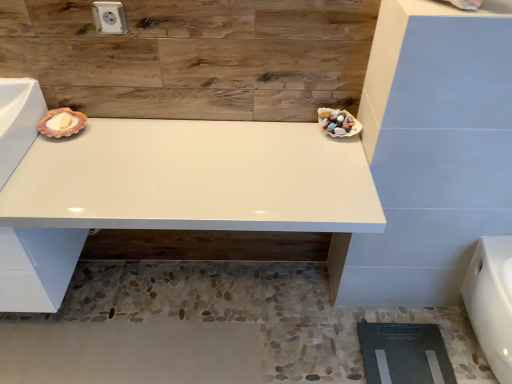
This screenshot has height=384, width=512. What are the coordinates of `white glossy porcelain at lower right` in the screenshot? It's located at (492, 302).

Locate an element on the screen. This screenshot has height=384, width=512. white plastic electric outlet at upper center is located at coordinates (109, 17).

Does white glossy vanity at center lie in front of white plastic electric outlet at upper center?

That is True.

From a real-world perspective, which object stands above the other?

white plastic electric outlet at upper center.

Do you think white glossy vanity at center is within white plastic electric outlet at upper center, or outside of it?

white glossy vanity at center is outside white plastic electric outlet at upper center.

Considering the sizes of objects white glossy vanity at center and white plastic electric outlet at upper center in the image provided, who is thinner, white glossy vanity at center or white plastic electric outlet at upper center?

white plastic electric outlet at upper center is thinner.

Are white plastic electric outlet at upper center and white glossy porcelain at lower right making contact?

white plastic electric outlet at upper center and white glossy porcelain at lower right are not in contact.

Does white plastic electric outlet at upper center contain white glossy porcelain at lower right?

No, white glossy porcelain at lower right is not inside white plastic electric outlet at upper center.

Is white glossy porcelain at lower right at the back of white plastic electric outlet at upper center?

white plastic electric outlet at upper center is not turned away from white glossy porcelain at lower right.

Considering the positions of points (98, 6) and (497, 322), is point (98, 6) farther from camera compared to point (497, 322)?

No, it is in front of (497, 322).

Considering the points (467, 275) and (124, 18), which point is in front, point (467, 275) or point (124, 18)?

Point (124, 18)

Is white glossy porcelain at lower right looking in the opposite direction of white plastic electric outlet at upper center?

white glossy porcelain at lower right is not turned away from white plastic electric outlet at upper center.

From a real-world perspective, is white glossy porcelain at lower right on top of white plastic electric outlet at upper center?

No, from a real-world perspective, white glossy porcelain at lower right is not above white plastic electric outlet at upper center.

Locate an element on the screen. vanity in front of the white plastic electric outlet at upper center is located at coordinates (160, 186).

Based on the photo, is white plastic electric outlet at upper center bigger than white glossy vanity at center?

No, white plastic electric outlet at upper center is not bigger than white glossy vanity at center.

Which of these two, white plastic electric outlet at upper center or white glossy vanity at center, stands shorter?

Standing shorter between the two is white plastic electric outlet at upper center.

From a real-world perspective, is white plastic electric outlet at upper center over white glossy vanity at center?

Yes.

Considering the relative sizes of white glossy porcelain at lower right and white glossy vanity at center in the image provided, is white glossy porcelain at lower right thinner than white glossy vanity at center?

Correct, the width of white glossy porcelain at lower right is less than that of white glossy vanity at center.

Is white glossy vanity at center completely or partially inside white glossy porcelain at lower right?

Definitely not — white glossy vanity at center is not inside white glossy porcelain at lower right.

Is white glossy vanity at center taller or shorter than white glossy porcelain at lower right?

Considering their sizes, white glossy vanity at center has more height than white glossy porcelain at lower right.

Is white glossy vanity at center inside the boundaries of white glossy porcelain at lower right, or outside?

white glossy vanity at center is spatially situated outside white glossy porcelain at lower right.

Is white glossy vanity at center to the left of white glossy porcelain at lower right from the viewer's perspective?

Correct, you'll find white glossy vanity at center to the left of white glossy porcelain at lower right.

Where is `vanity below the white plastic electric outlet at upper center (from the image's perspective)`? Image resolution: width=512 pixels, height=384 pixels. vanity below the white plastic electric outlet at upper center (from the image's perspective) is located at coordinates (160, 186).

The width and height of the screenshot is (512, 384). What are the coordinates of `electric outlet behind the white glossy porcelain at lower right` in the screenshot? It's located at (109, 17).

From the image, which object appears to be farther from white glossy porcelain at lower right, white glossy vanity at center or white plastic electric outlet at upper center?

Based on the image, white plastic electric outlet at upper center appears to be further to white glossy porcelain at lower right.

From the image, which object appears to be farther from white glossy vanity at center, white glossy porcelain at lower right or white plastic electric outlet at upper center?

Based on the image, white glossy porcelain at lower right appears to be further to white glossy vanity at center.

Estimate the real-world distances between objects in this image. Which object is further from white glossy porcelain at lower right, white plastic electric outlet at upper center or white glossy vanity at center?

white plastic electric outlet at upper center.

Based on their spatial positions, is white plastic electric outlet at upper center or white glossy porcelain at lower right closer to white glossy vanity at center?

white plastic electric outlet at upper center lies closer to white glossy vanity at center than the other object.

When comparing their distances from white plastic electric outlet at upper center, does white glossy vanity at center or white glossy porcelain at lower right seem closer?

white glossy vanity at center is closer to white plastic electric outlet at upper center.

In the scene shown: Looking at the image, which one is located further to white plastic electric outlet at upper center, white glossy porcelain at lower right or white glossy vanity at center?

The object further to white plastic electric outlet at upper center is white glossy porcelain at lower right.

In order to click on vanity situated between white plastic electric outlet at upper center and white glossy porcelain at lower right from left to right in this screenshot , I will do `click(160, 186)`.